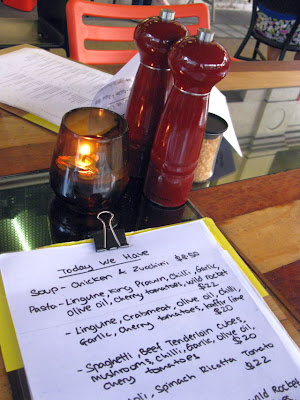
Image resolution: width=300 pixels, height=400 pixels. In order to click on menu handwritten in black marker on white paper in this screenshot , I will do `click(163, 333)`, `click(119, 87)`.